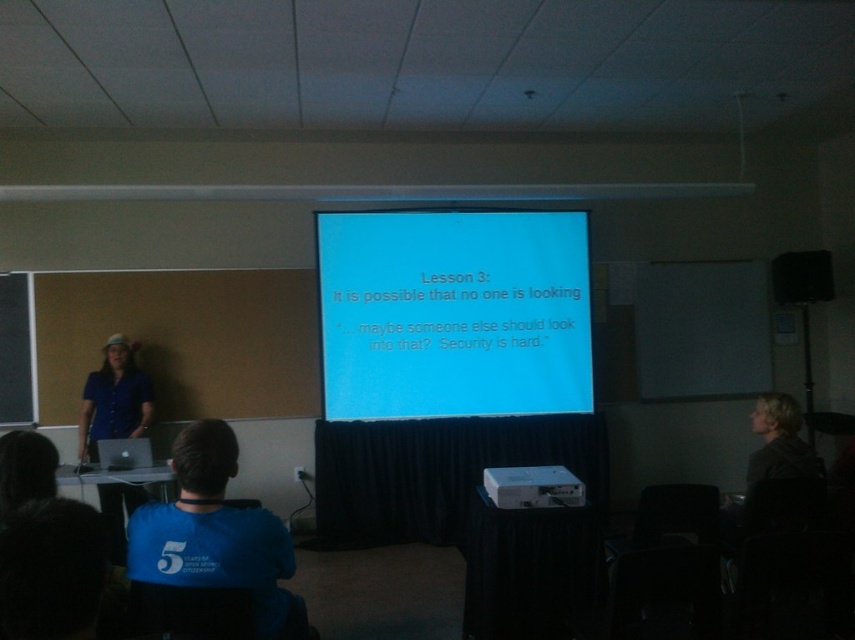
Which of these two, blue fabric shirt at lower center or matte black speaker at upper right, stands shorter?

Standing shorter between the two is matte black speaker at upper right.

Between point (190, 508) and point (827, 285), which one is positioned behind?

Positioned behind is point (827, 285).

This screenshot has width=855, height=640. Identify the location of blue fabric shirt at lower center. (210, 552).

Does blue matte projector screen at center appear on the right side of matte black speaker at upper right?

No, blue matte projector screen at center is not to the right of matte black speaker at upper right.

Between blue matte projector screen at center and matte black speaker at upper right, which one is positioned higher?

matte black speaker at upper right is higher up.

Where is `blue matte projector screen at center`? Image resolution: width=855 pixels, height=640 pixels. blue matte projector screen at center is located at coordinates (453, 314).

Measure the distance from blue fabric shirt at lower center to blue fabric shirt at left.

blue fabric shirt at lower center and blue fabric shirt at left are 9.74 feet apart from each other.

Is point (251, 522) closer to camera compared to point (90, 458)?

Yes, point (251, 522) is closer to viewer.

This screenshot has width=855, height=640. Find the location of `blue fabric shirt at lower center`. blue fabric shirt at lower center is located at coordinates tap(210, 552).

Locate an element on the screen. blue fabric shirt at lower center is located at coordinates (210, 552).